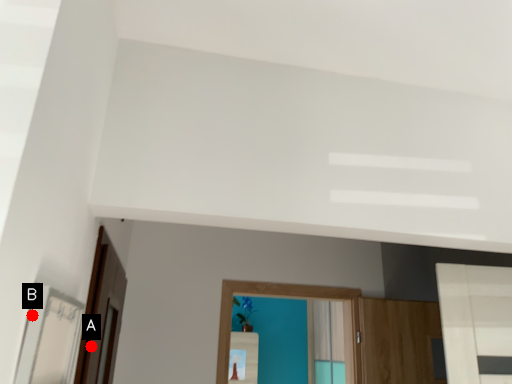
Question: Two points are circled on the image, labeled by A and B beside each circle. Which of the following is the farthest from the observer?

Choices:
 (A) A is further
 (B) B is further

Answer: (A)